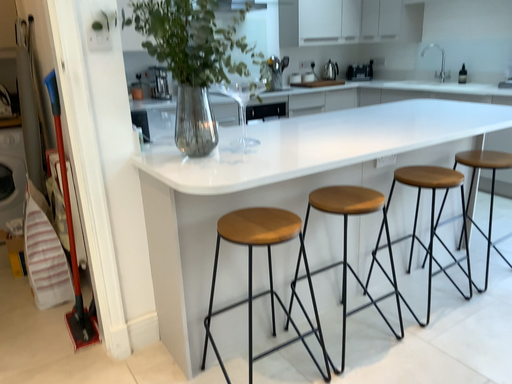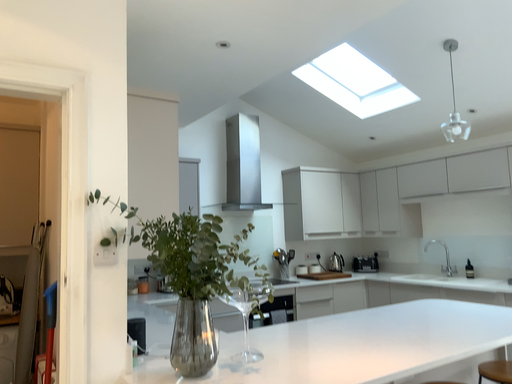
Question: Which way did the camera rotate in the video?

Choices:
 (A) rotated upward
 (B) rotated downward

Answer: (A)